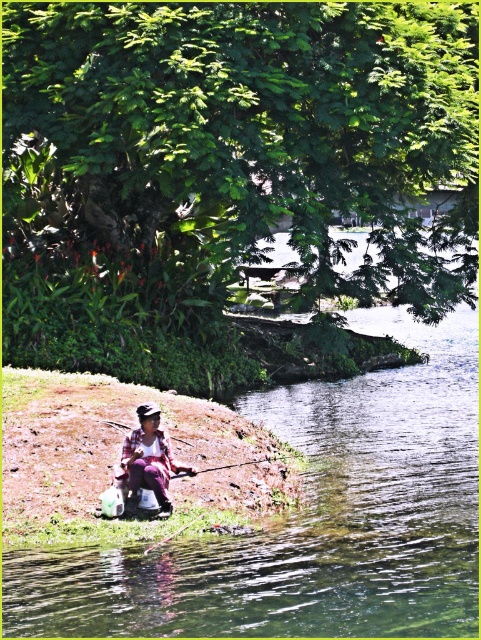
You are a photographer standing at the riverbank trying to capture the scene. You notice two points marked in the image. Which point, point (x=87, y=634) or point (x=133, y=497), is closer to your camera?

Point (x=87, y=634) is closer to the camera than point (x=133, y=497).

You are a hiker who wants to cross the river using a sturdy stick. You see the clear water at river right and the purple fabric at lower left. Which object is located to the right of the other?

The clear water at river right is positioned on the right side of purple fabric at lower left, so the clear water at river right is to the right of the purple fabric at lower left.